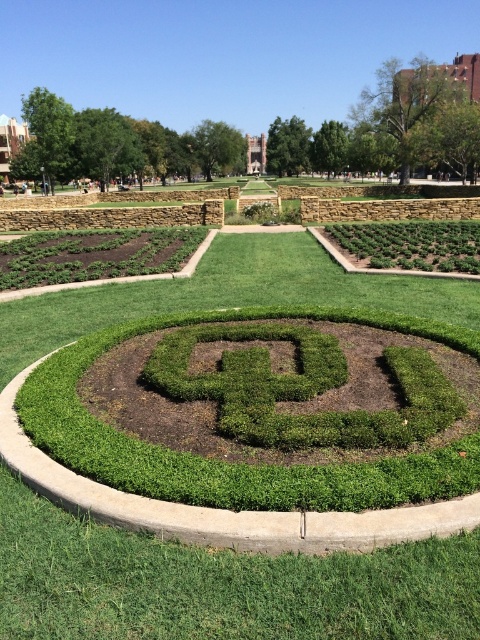
You are a groundskeeper who needs to water two areas in the garden. You have a hose that can reach 10 feet. If you stand at the green shrubbery at lower left, can you water the green grass at center without moving the hose?

The distance between the green grass at center and the green shrubbery at lower left is 9.80 feet. Since the hose can reach 10 feet, you can water the green grass at center from the green shrubbery at lower left without moving the hose.

You are a gardener who needs to water the green shrubbery at lower left and the green leafy hedge at right. Based on their positions in the garden, which one is closer to the water source located at the bottom edge of the image?

The green shrubbery at lower left is closer to the water source because it is located below the green leafy hedge at right, placing it nearer to the bottom edge of the image.

You are standing in the garden and want to walk from point (92, 232) to point (364, 230). Which direction should you face to move towards the farther point?

You should face away from the camera since point (364, 230) is farther from the camera than point (92, 232).